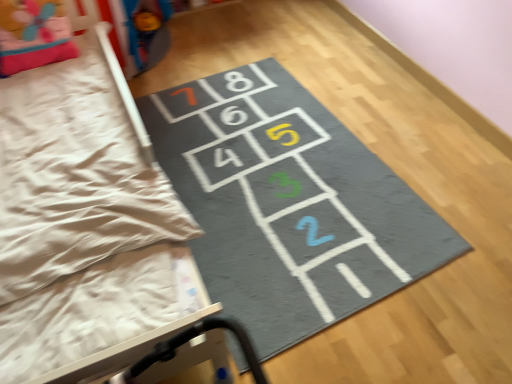
Identify the location of empty space that is ontop of gray fabric hopscotch at center (from a real-world perspective). The height and width of the screenshot is (384, 512). (260, 172).